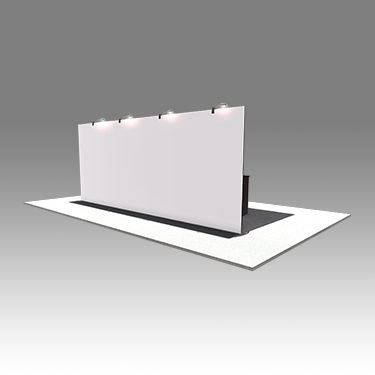
I want to click on dark gray mat, so click(x=263, y=218).